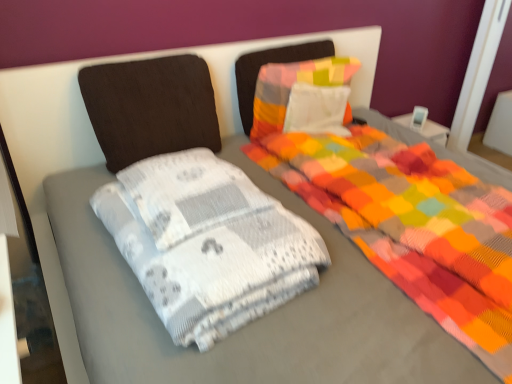
Question: Considering their positions, is dark brown fabric pillow at upper left, which is the second pillow from right to left, located in front of or behind white textured blanket at center?

Choices:
 (A) front
 (B) behind

Answer: (B)

Question: Is point (164, 104) positioned closer to the camera than point (197, 327)?

Choices:
 (A) farther
 (B) closer

Answer: (A)

Question: Which is nearer to the white textured blanket at center?

Choices:
 (A) dark brown fabric pillow at upper left, which is the second pillow from right to left
 (B) multicolored fabric pillow at center, the 2th pillow from the left

Answer: (A)

Question: Which object is positioned closest to the dark brown fabric pillow at upper left, placed as the 1th pillow when sorted from left to right?

Choices:
 (A) multicolored fabric pillow at center, the 2th pillow from the left
 (B) white textured blanket at center

Answer: (A)